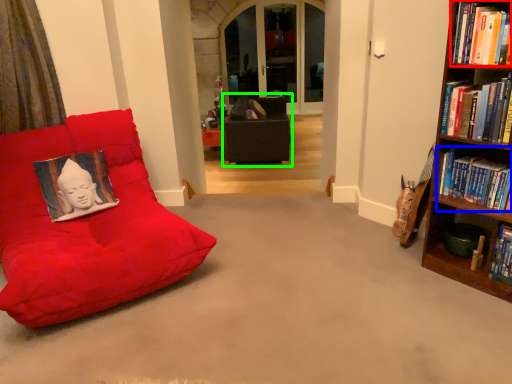
Question: Considering the real-world distances, which object is closest to book (highlighted by a red box)? book (highlighted by a blue box) or bean bag chair (highlighted by a green box).

Choices:
 (A) book
 (B) bean bag chair

Answer: (A)